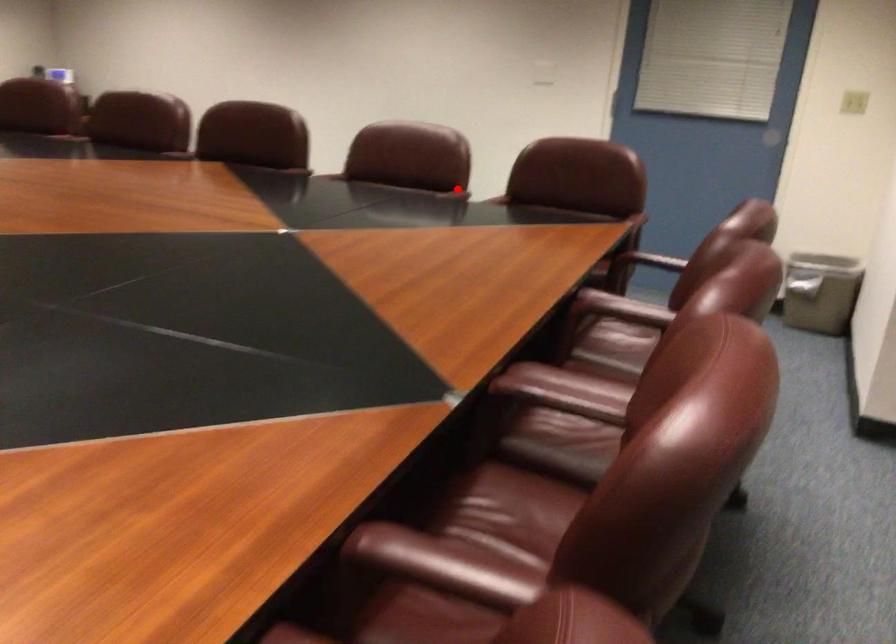
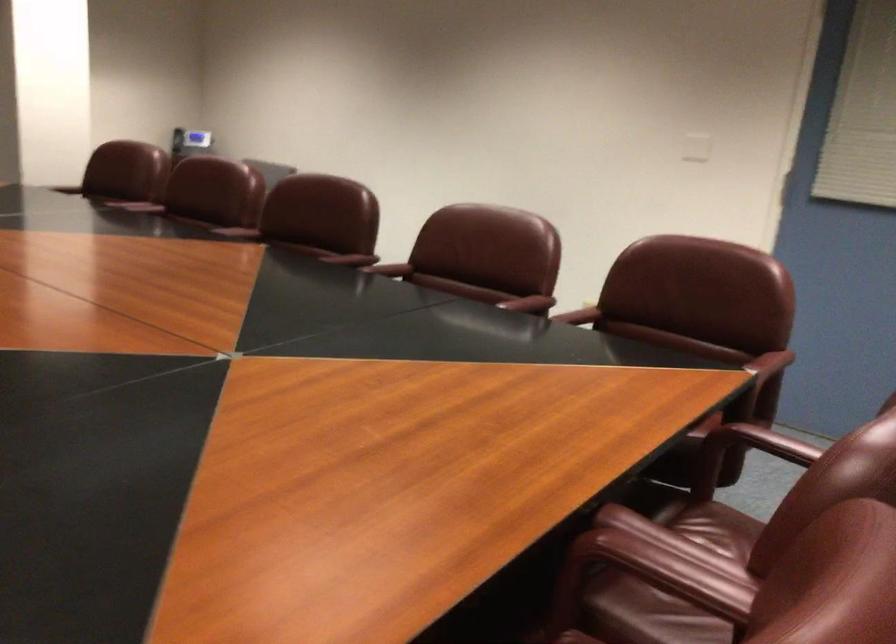
In the second image, find the point that corresponds to the highlighted location in the first image.

(529, 303)